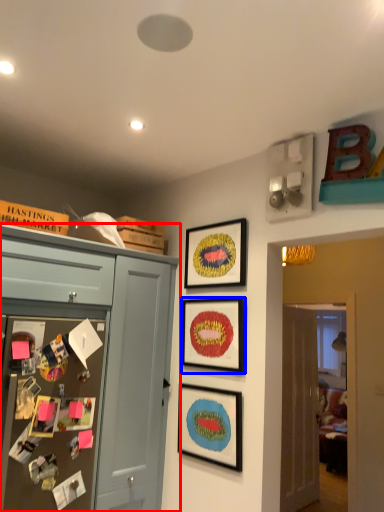
Question: Which point is closer to the camera, cabinetry (highlighted by a red box) or picture frame (highlighted by a blue box)?

Choices:
 (A) cabinetry
 (B) picture frame

Answer: (A)